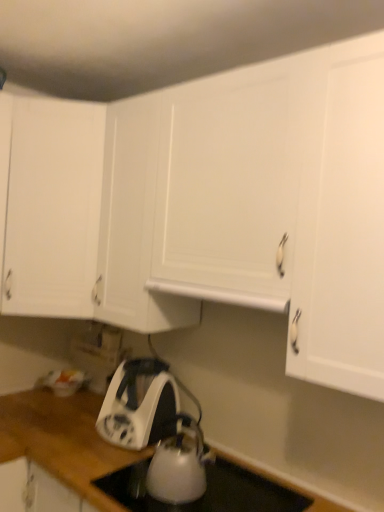
Find the location of `vacant area on top of white glossy kettle at lower center (from a real-world perspective)`. vacant area on top of white glossy kettle at lower center (from a real-world perspective) is located at coordinates (218, 485).